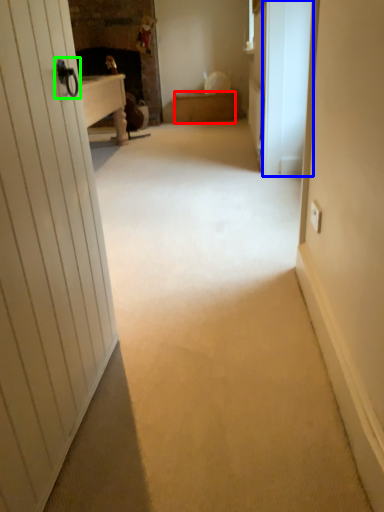
Question: Considering the real-world distances, which object is closest to furniture (highlighted by a red box)? screen door (highlighted by a blue box) or door handle (highlighted by a green box).

Choices:
 (A) screen door
 (B) door handle

Answer: (A)